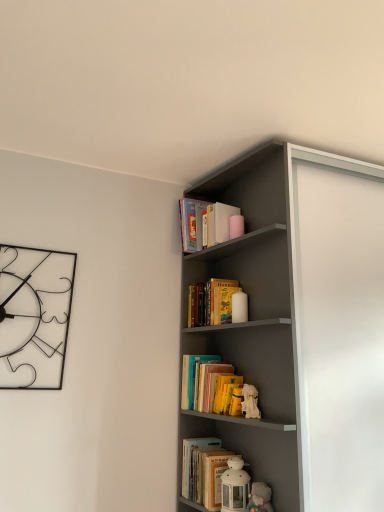
Question: Considering the positions of white plush toy at middle, which is the 1th toy from top to bottom, and yellow paper book at upper center, acting as the 2th book starting from the back, in the image, is white plush toy at middle, which is the 1th toy from top to bottom, wider or thinner than yellow paper book at upper center, acting as the 2th book starting from the back,?

Choices:
 (A) thin
 (B) wide

Answer: (A)

Question: Looking at the image, does white plush toy at middle, which is the 1th toy from top to bottom, seem bigger or smaller compared to yellow paper book at upper center, acting as the 2th book starting from the back?

Choices:
 (A) small
 (B) big

Answer: (A)

Question: Which object is the farthest from the white plush toy at middle, which is the 1th toy from top to bottom?

Choices:
 (A) matte gray bookshelf at upper right
 (B) hardcover book at upper center, which ranks as the 1th book in back-to-front order
 (C) wireframe metal clock at left
 (D) yellow paper book at upper center, the 2th book positioned from the front
 (E) white matte lantern at lower center, the second toy when ordered from top to bottom

Answer: (C)

Question: Which of these objects is positioned closest to the white plush toy at middle, arranged as the 2th toy when ordered from the bottom?

Choices:
 (A) matte gray bookshelf at upper right
 (B) yellow paper book at upper center, the 2th book positioned from the front
 (C) white matte lantern at lower center, placed as the first toy when sorted from bottom to top
 (D) hardcover book at upper center, the 3th book from the bottom
 (E) wireframe metal clock at left

Answer: (C)